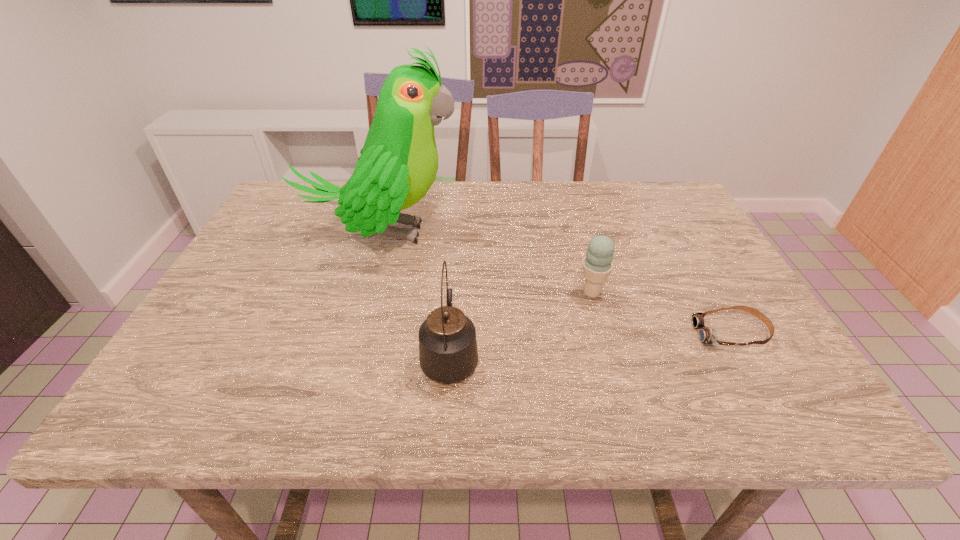
Identify the location of free space that satisfies the following two spatial constraints: 1. spout on the second tallest object; 2. on the beak of the tallest object. This screenshot has height=540, width=960. (458, 233).

Where is `vacant region that satisfies the following two spatial constraints: 1. on the beak of the tallest object; 2. on the right side of the third tallest object`? This screenshot has width=960, height=540. vacant region that satisfies the following two spatial constraints: 1. on the beak of the tallest object; 2. on the right side of the third tallest object is located at coordinates (363, 293).

Where is `free spot that satisfies the following two spatial constraints: 1. on the beak of the second farthest object; 2. on the left side of the farthest object`? This screenshot has width=960, height=540. free spot that satisfies the following two spatial constraints: 1. on the beak of the second farthest object; 2. on the left side of the farthest object is located at coordinates (363, 293).

Find the location of a particular element. free space that satisfies the following two spatial constraints: 1. on the beak of the parakeet; 2. on the back side of the second shortest object is located at coordinates (363, 293).